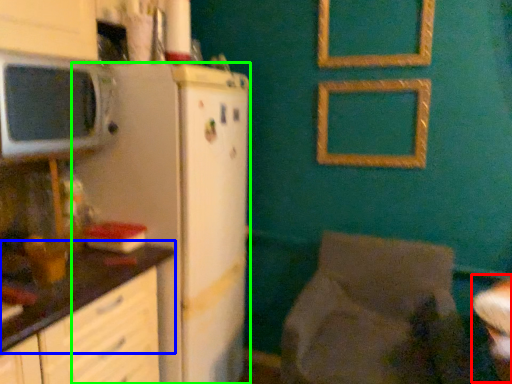
Question: Based on their relative distances, which object is farther from table (highlighted by a red box)? Choose from countertop (highlighted by a blue box) and refrigerator (highlighted by a green box).

Choices:
 (A) countertop
 (B) refrigerator

Answer: (A)